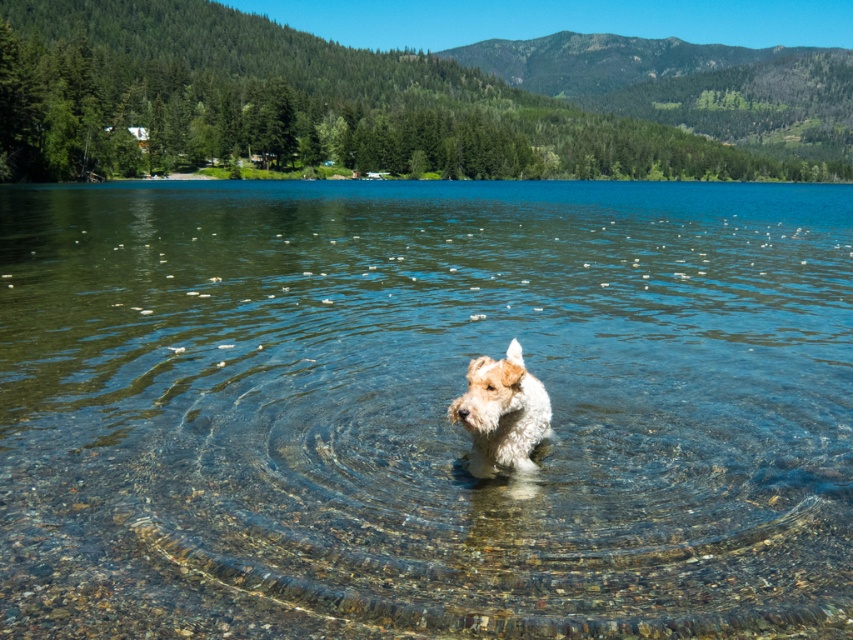
Question: Does clear glass water at center appear on the right side of white fur dog at center?

Choices:
 (A) yes
 (B) no

Answer: (A)

Question: Is clear glass water at center smaller than white fur dog at center?

Choices:
 (A) no
 (B) yes

Answer: (A)

Question: Which point appears closest to the camera in this image?

Choices:
 (A) (547, 280)
 (B) (524, 406)

Answer: (B)

Question: Does clear glass water at center appear on the right side of white fur dog at center?

Choices:
 (A) no
 (B) yes

Answer: (B)